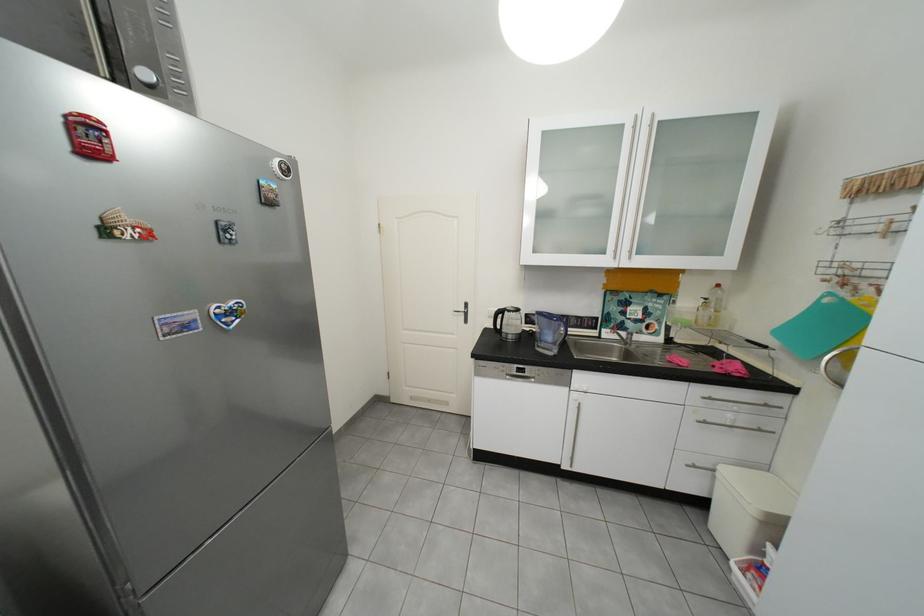
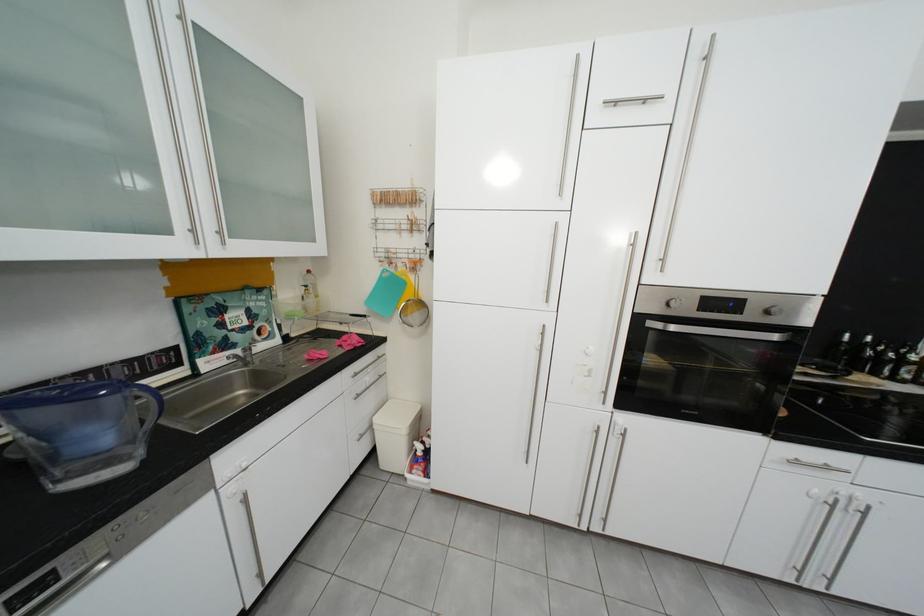
Find the pixel in the second image that matches the point at 837,302 in the first image.

(395, 276)